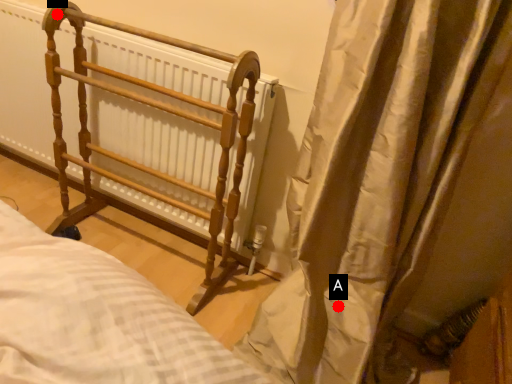
Question: Two points are circled on the image, labeled by A and B beside each circle. Which point appears farthest from the camera in this image?

Choices:
 (A) A is further
 (B) B is further

Answer: (B)